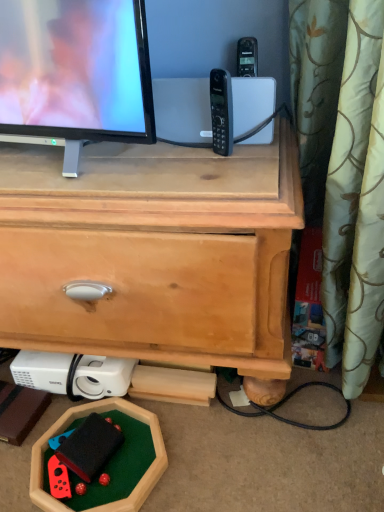
Question: Is rubberized red game controller at lower left shorter than black plastic phone at center?

Choices:
 (A) no
 (B) yes

Answer: (B)

Question: Is rubberized red game controller at lower left not inside black plastic phone at center?

Choices:
 (A) yes
 (B) no

Answer: (A)

Question: Can you confirm if rubberized red game controller at lower left is smaller than black plastic phone at center?

Choices:
 (A) no
 (B) yes

Answer: (A)

Question: Is rubberized red game controller at lower left oriented towards black plastic phone at center?

Choices:
 (A) no
 (B) yes

Answer: (A)

Question: From a real-world perspective, does rubberized red game controller at lower left stand above black plastic phone at center?

Choices:
 (A) no
 (B) yes

Answer: (A)

Question: Can you confirm if rubberized red game controller at lower left is bigger than black plastic phone at center?

Choices:
 (A) no
 (B) yes

Answer: (B)

Question: Is rubberized red game controller at lower left aimed at light brown wood chest of drawers at center?

Choices:
 (A) yes
 (B) no

Answer: (B)

Question: Can you confirm if rubberized red game controller at lower left is positioned to the right of light brown wood chest of drawers at center?

Choices:
 (A) yes
 (B) no

Answer: (A)

Question: Is rubberized red game controller at lower left completely or partially outside of light brown wood chest of drawers at center?

Choices:
 (A) no
 (B) yes

Answer: (B)

Question: Is light brown wood chest of drawers at center at the back of rubberized red game controller at lower left?

Choices:
 (A) no
 (B) yes

Answer: (B)

Question: Is rubberized red game controller at lower left positioned before light brown wood chest of drawers at center?

Choices:
 (A) yes
 (B) no

Answer: (B)

Question: Is rubberized red game controller at lower left to the left of light brown wood chest of drawers at center from the viewer's perspective?

Choices:
 (A) yes
 (B) no

Answer: (B)

Question: Does black plastic phone at center appear on the right side of rubberized red game controller at lower left?

Choices:
 (A) yes
 (B) no

Answer: (A)